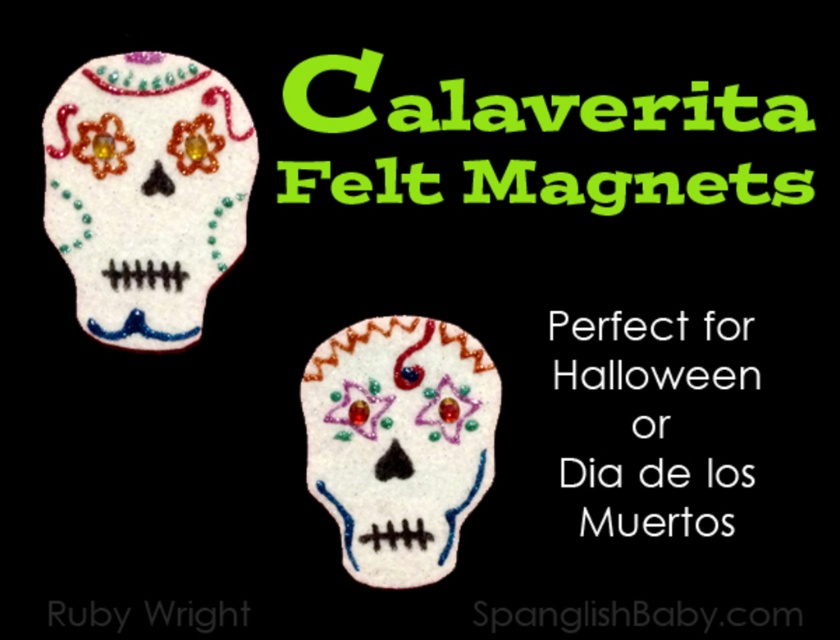
Which is behind, point (117, 260) or point (368, 442)?

Positioned behind is point (368, 442).

Can you confirm if white felt skull at upper left is positioned to the left of white felt skull at center?

Indeed, white felt skull at upper left is positioned on the left side of white felt skull at center.

I want to click on white felt skull at upper left, so click(x=147, y=193).